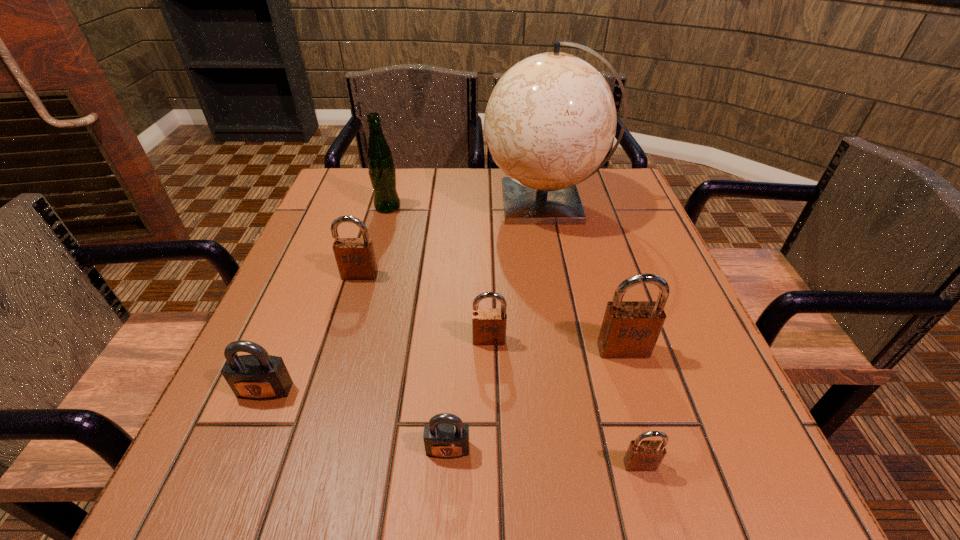
You are a GUI agent. You are given a task and a screenshot of the screen. Output one action in this format:
    pyautogui.click(x=<x>, y=<y>)
    Task: Click on the blank space located on the front-facing side of the farthest padlock
    This screenshot has width=960, height=540.
    Given the screenshot: What is the action you would take?
    336,352

Identify the location of free region located on the front-facing side of the third padlock from right to left. (492, 494).

At what (x,y) coordinates should I click in order to perform the action: click on vacant space located on the front of the leftmost object near the keyhole. Please return your answer as a coordinate pair (x, y). This screenshot has width=960, height=540. Looking at the image, I should click on (237, 456).

The width and height of the screenshot is (960, 540). I want to click on vacant space located 0.050m on the front of the fifth object from right to left near the keyhole, so 445,496.

Find the location of `globe located in the far edge section of the desktop`. globe located in the far edge section of the desktop is located at coordinates (551, 119).

The width and height of the screenshot is (960, 540). I want to click on beer bottle that is positioned at the far edge, so click(381, 169).

Find the location of a particular element. beer bottle at the left edge is located at coordinates (381, 169).

The image size is (960, 540). In order to click on globe at the right edge in this screenshot , I will do `click(551, 119)`.

Find the location of a particular element. object that is at the far left corner is located at coordinates (381, 169).

Find the location of a particular element. This screenshot has width=960, height=540. object located at the far right corner is located at coordinates (551, 119).